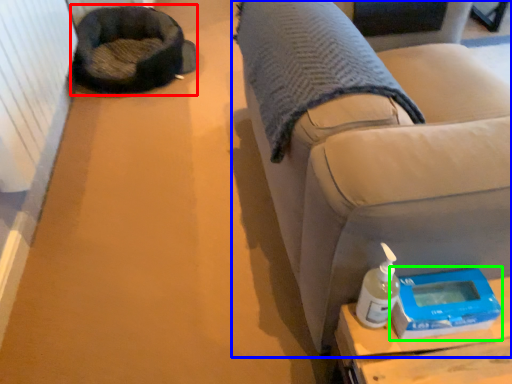
Question: Based on their relative distances, which object is farther from bean bag chair (highlighted by a red box)? Choose from furniture (highlighted by a blue box) and scale (highlighted by a green box).

Choices:
 (A) furniture
 (B) scale

Answer: (B)